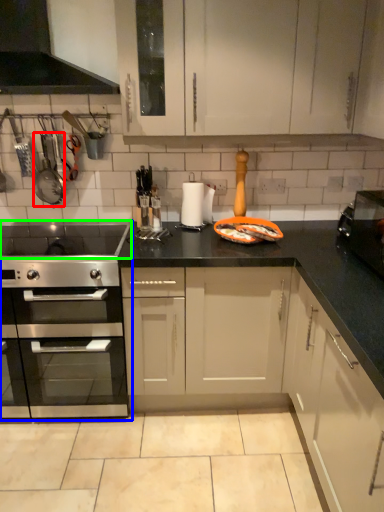
Question: Estimate the real-world distances between objects in this image. Which object is closer to appliance (highlighted by a red box), kitchen appliance (highlighted by a blue box) or gas stove (highlighted by a green box)?

Choices:
 (A) kitchen appliance
 (B) gas stove

Answer: (B)